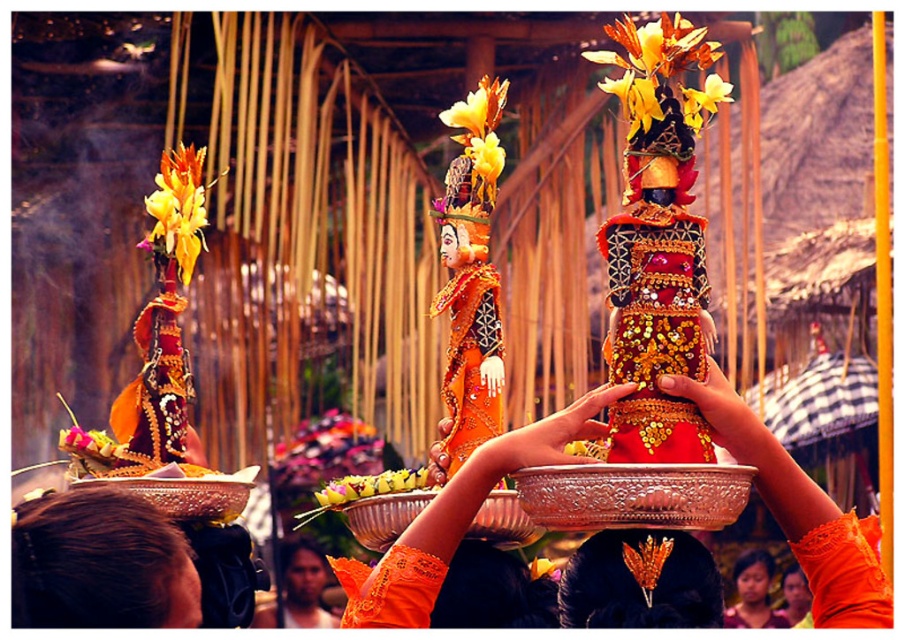
You are a photographer standing at the back of the ceremony area. You want to take a closeup photo of the floral garland at center. Given that your camera can focus up to 150 meters, will you be able to capture it clearly?

The floral garland at center is 156.13 meters away from the viewer. Since your camera can only focus up to 150 meters, you won the be able to capture it clearly.

In the image of the Balinese ceremony, there is a point labeled at coordinates (640, 580). What object is located at this point?

The point at coordinates (640, 580) indicates the gold leaf headpiece at center.